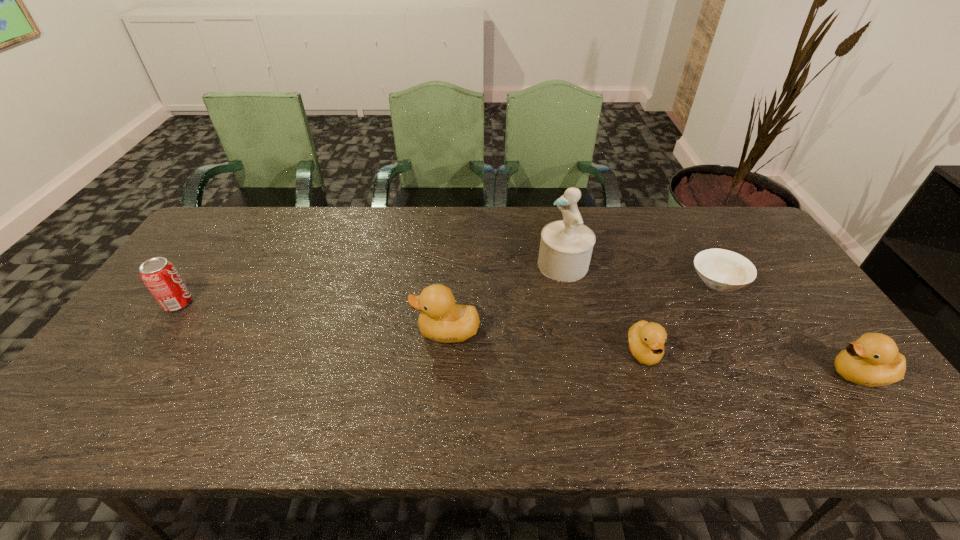
The image size is (960, 540). Identify the location of free space located on the back of the fifth object from left to right. (688, 232).

Find the location of a particular element. object located in the far edge section of the desktop is located at coordinates (566, 246).

I want to click on object present at the left edge, so click(160, 276).

Locate an element on the screen. The image size is (960, 540). duckling present at the right edge is located at coordinates (873, 359).

Locate an element on the screen. The height and width of the screenshot is (540, 960). bowl at the right edge is located at coordinates (722, 270).

You are a GUI agent. You are given a task and a screenshot of the screen. Output one action in this format:
    pyautogui.click(x=<x>, y=<y>)
    Task: Click on the object that is at the near right corner
    The image size is (960, 540).
    Given the screenshot: What is the action you would take?
    pyautogui.click(x=873, y=359)

This screenshot has width=960, height=540. In order to click on vacant space at the far edge of the desktop in this screenshot , I will do `click(614, 224)`.

Locate an element on the screen. The width and height of the screenshot is (960, 540). vacant area at the near edge of the desktop is located at coordinates (355, 372).

The height and width of the screenshot is (540, 960). I want to click on vacant space at the left edge, so click(x=204, y=288).

This screenshot has width=960, height=540. In order to click on vacant space at the right edge of the desktop in this screenshot , I will do `click(828, 352)`.